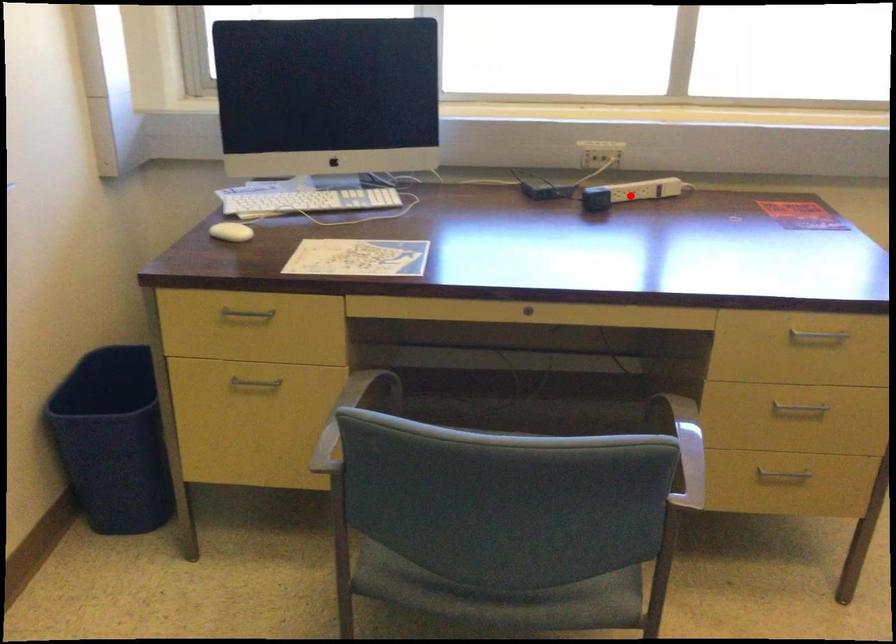
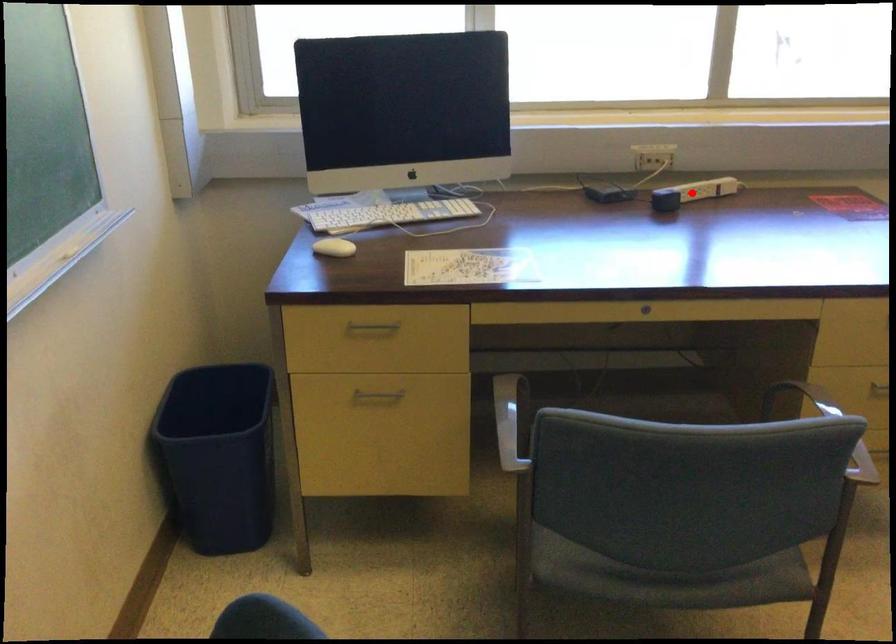
I am providing you with two images of the same scene from different viewpoints. A red point is marked on the first image and another point is marked on the second image. Do the highlighted points in image1 and image2 indicate the same real-world spot?

Yes